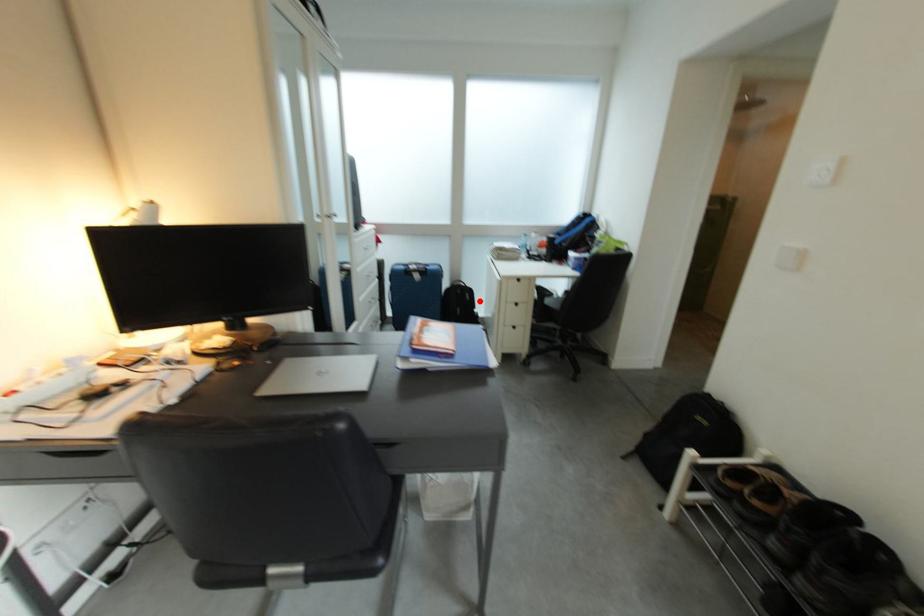
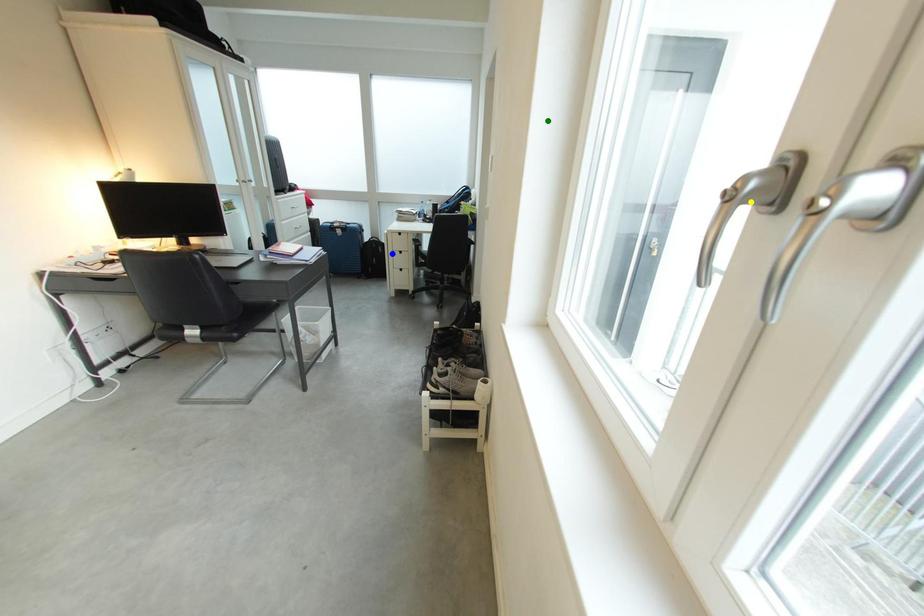
Question: I am providing you with two images of the same scene from different viewpoints. A red point is marked on the first image. You are given multiple points on the second image. In image 2, which mark is for the same physical point as the one in image 1?

Choices:
 (A) blue point
 (B) green point
 (C) yellow point

Answer: (A)